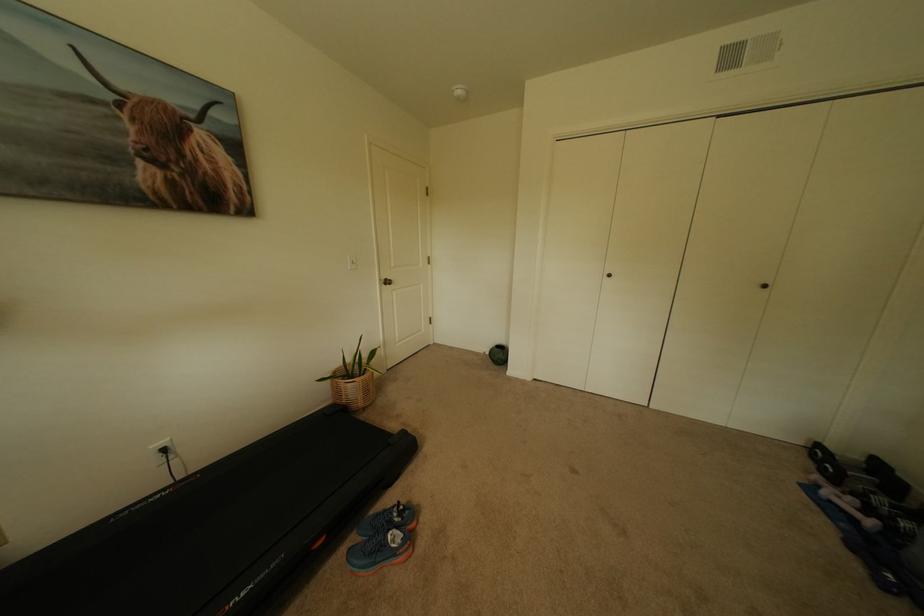
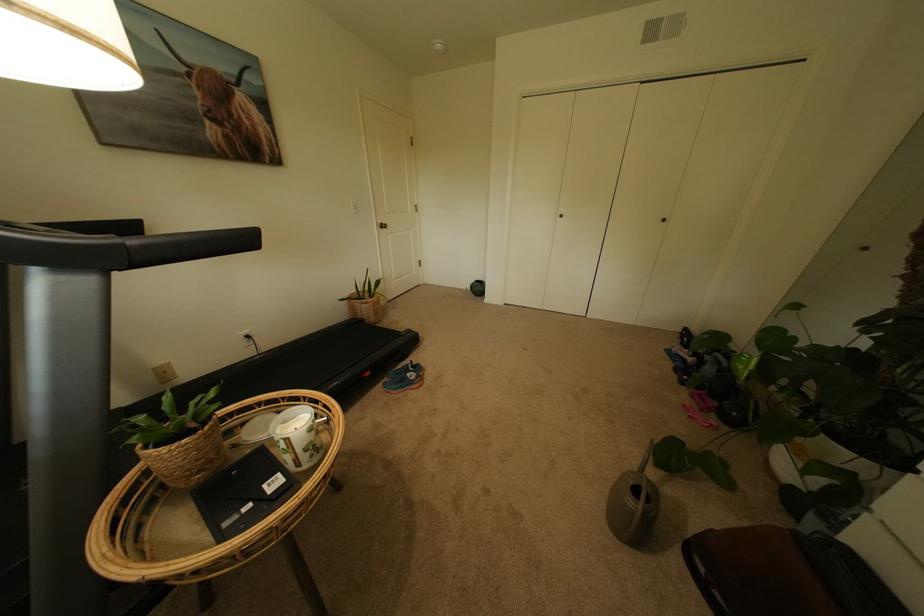
Where in the second image is the point corresponding to (134,134) from the first image?

(204, 100)